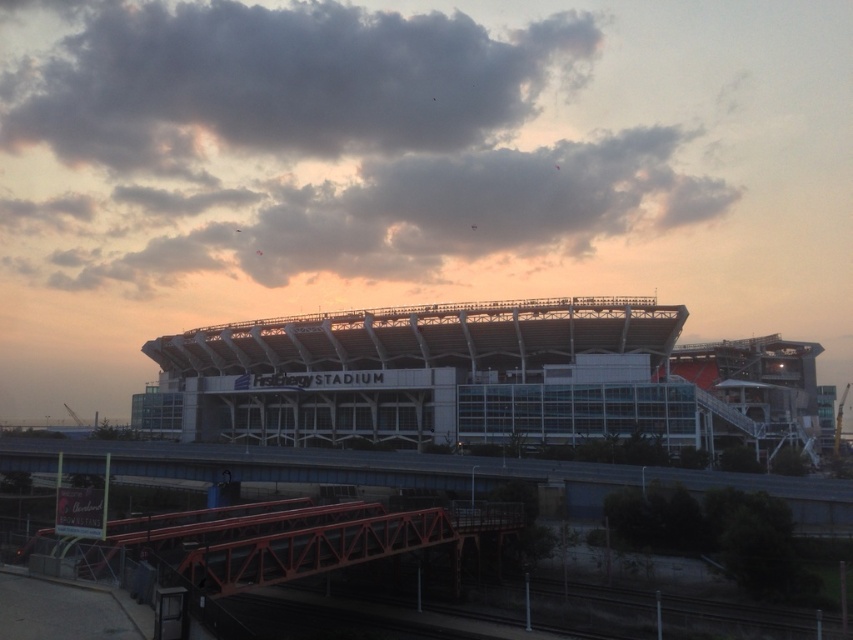
Which is above, white glass stadium at center or cloudy sky at upper center?

cloudy sky at upper center is above.

Can you confirm if white glass stadium at center is positioned below cloudy sky at upper center?

Indeed, white glass stadium at center is positioned under cloudy sky at upper center.

I want to click on white glass stadium at center, so pos(486,378).

Who is higher up, dark gray cloud at upper center or cloudy sky at upper center?

Positioned higher is dark gray cloud at upper center.

Based on the photo, does dark gray cloud at upper center have a smaller size compared to cloudy sky at upper center?

Yes.

Where is `dark gray cloud at upper center`? This screenshot has width=853, height=640. dark gray cloud at upper center is located at coordinates (277, 83).

Is white glass stadium at center taller than dark gray cloud at upper center?

No, white glass stadium at center is not taller than dark gray cloud at upper center.

Which is behind, point (410, 344) or point (209, 22)?

The point (209, 22) is more distant.

In order to click on white glass stadium at center in this screenshot , I will do point(486,378).